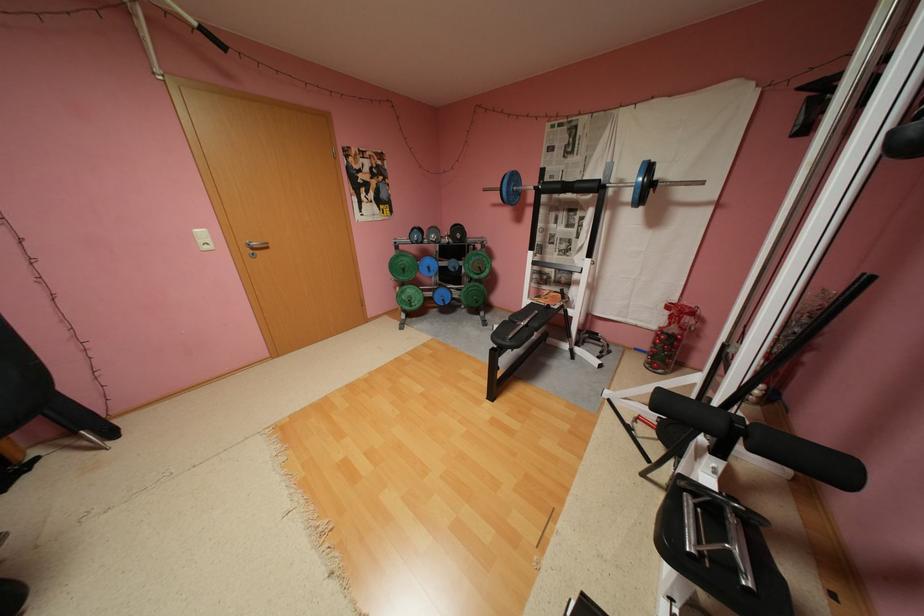
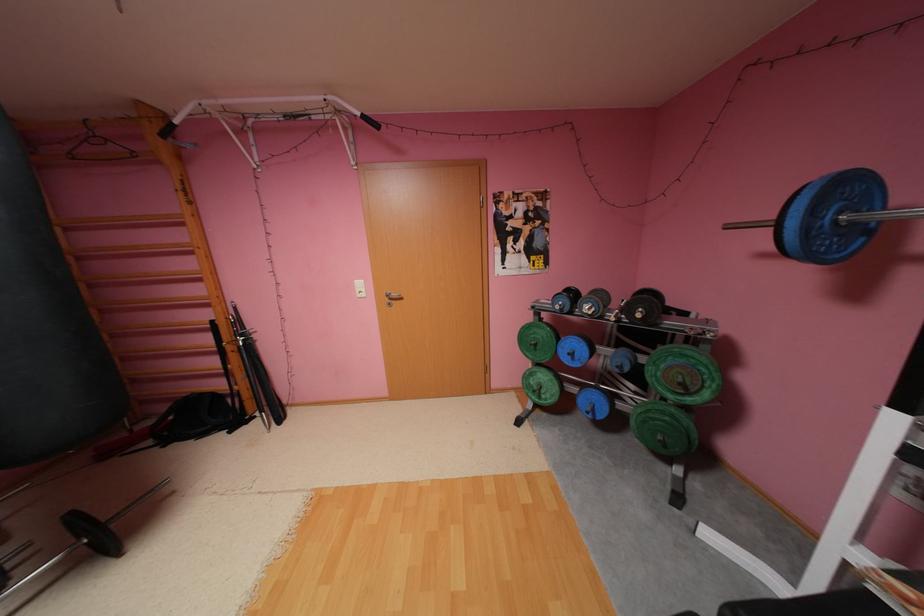
Find the pixel in the second image that matches (489,267) in the first image.

(690, 384)